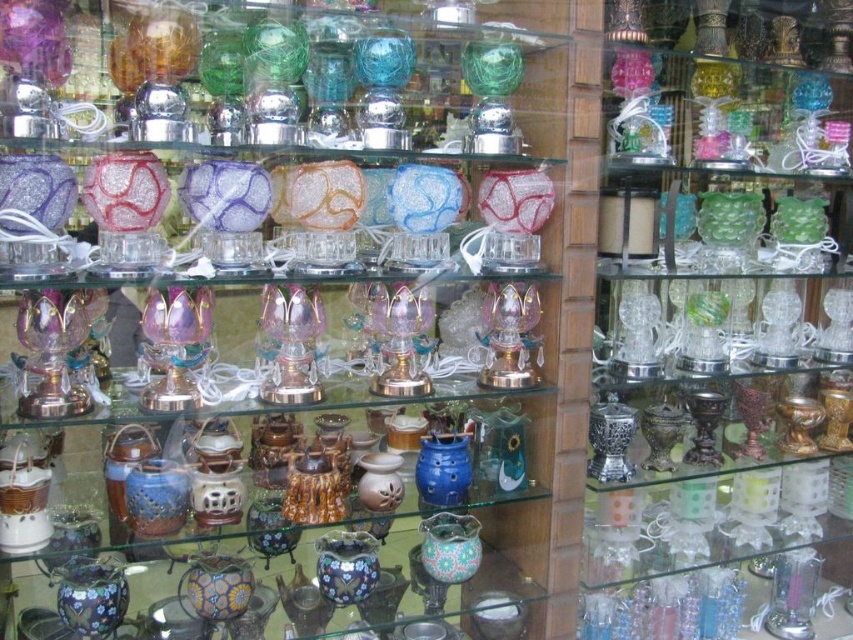
You are standing in front of the shop window and want to touch the point at coordinates point (445, 531). Can you reach it with your hand?

The point (445, 531) is 1.43 meters away from you, so you can reach it with your hand since it is within arm length.

You are a customer in the shop looking at the candles displayed on the shelf. You see a matte glass candle at center and a translucent glass candle at center. Which candle is positioned to the left?

The matte glass candle at center is to the left of the translucent glass candle at center.

You are a customer in the shop looking at the glass items displayed on the shelves. There are two points marked in the scene, point A at coordinates point [291,577] and point B at coordinates point [445,465]. Which point is closer to you?

Point point [291,577] is closer to you because it is further to the camera than point point [445,465].